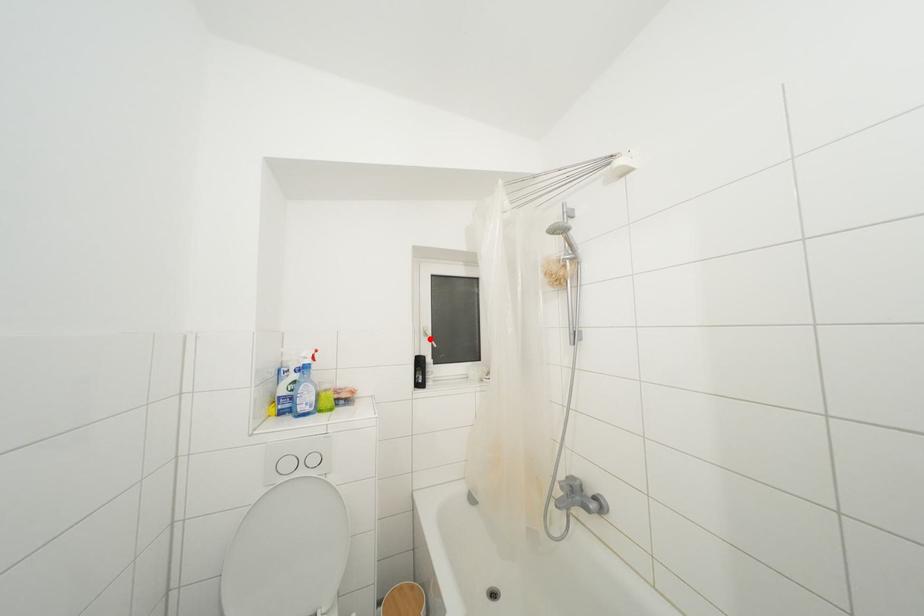
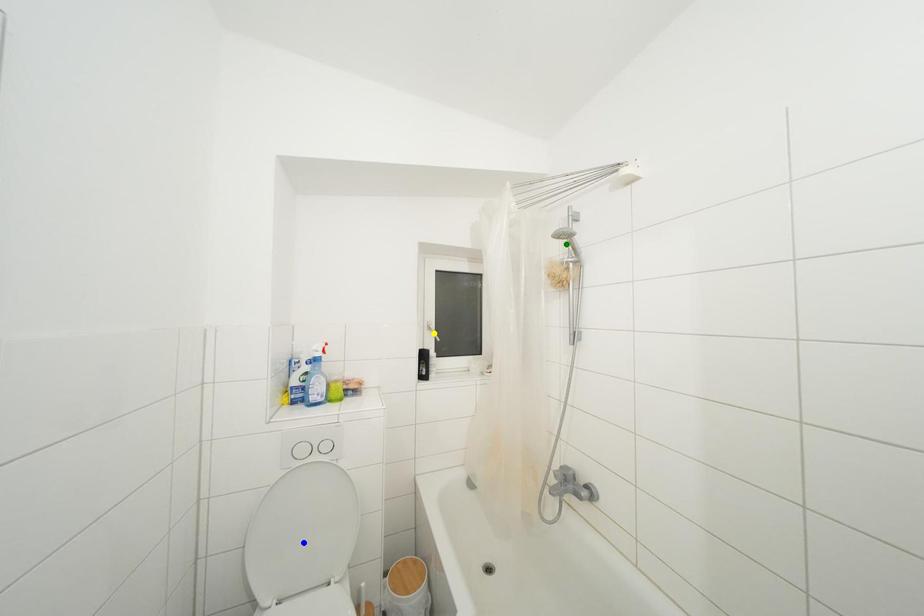
Question: I am providing you with two images of the same scene from different viewpoints. A red point is marked on the first image. You are given multiple points on the second image. Which point in image 2 is actually the same real-world point as the red point in image 1?

Choices:
 (A) green point
 (B) blue point
 (C) yellow point

Answer: (C)